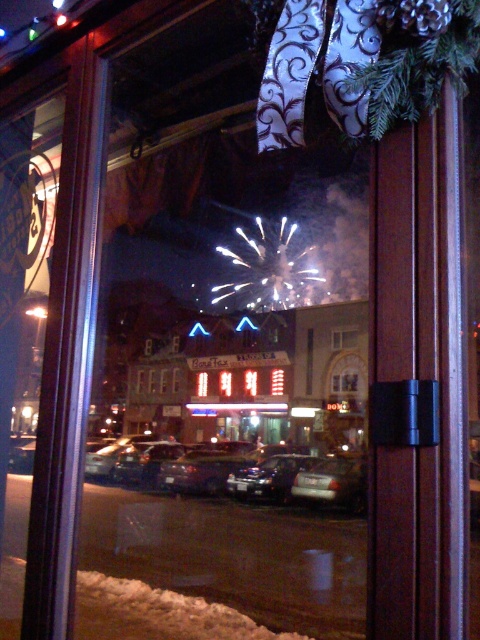
You are standing inside a building looking through a window at a nighttime street scene. You notice two points marked on the window frame at coordinates point (x=307, y=492) and point (x=346, y=337). Which point is closer to you?

Point (x=307, y=492) is closer to the viewer than point (x=346, y=337).

You are standing inside a room with a window. You notice a shiny black sedan at center and a transparent glass window at center. Which object takes up more space in the scene?

The transparent glass window at center takes up more space than the shiny black sedan at center because the sedan occupies less space than the window.